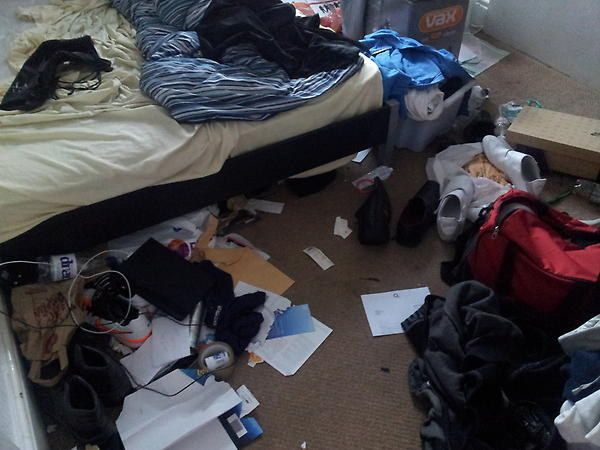
Identify the location of bed sheet. (115, 158).